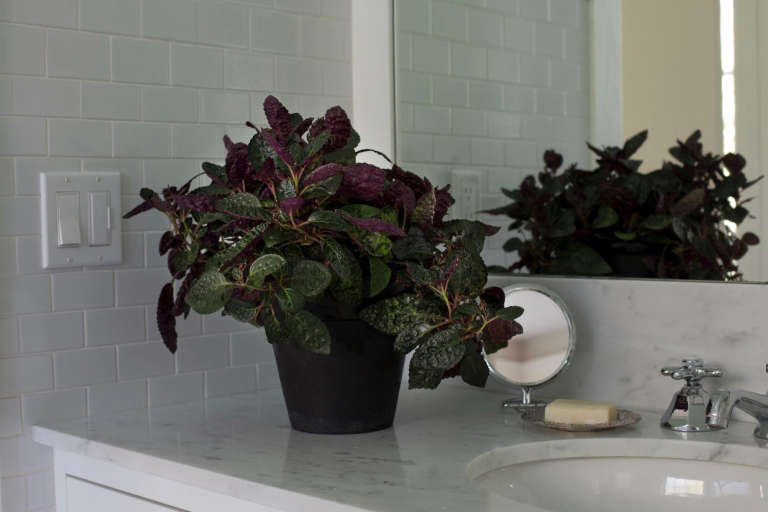
At what (x,y) coordinates should I click in order to perform the action: click on drawer. Please return your answer as a coordinate pair (x, y). This screenshot has height=512, width=768. Looking at the image, I should click on (100, 503).